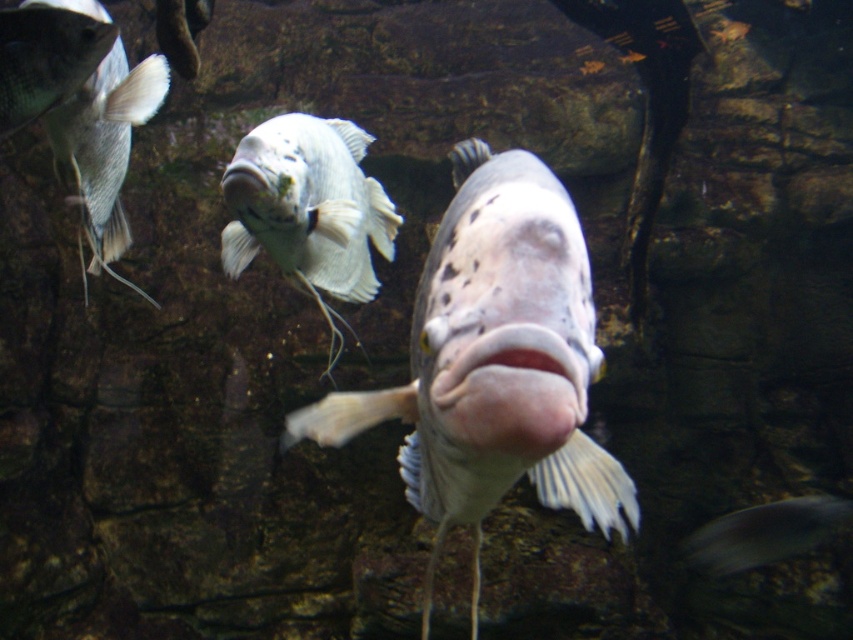
You are a marine biologist observing the underwater scene. You notice two fish, the matte white fish at upper left and the silvery metallic fish at lower right. Which one has a larger size?

The matte white fish at upper left is bigger than the silvery metallic fish at lower right.

You are a marine biologist observing underwater life. You notice a speckled white fish at center and a matte white fish at upper left. Given that the average distance between two fish of the same species in this environment is 25 inches, do you think these two fish are likely of the same species?

The distance between the speckled white fish at center and the matte white fish at upper left is 32.98 inches, which is greater than the average of 25 inches. This suggests they might not be of the same species, as same species fish typically maintain closer proximity.

You are a marine biologist observing the underwater scene. You notice two fish, the speckled white fish at center and the matte white fish at upper left. Which fish has a greater height?

The speckled white fish at center is taller than the matte white fish at upper left according to the description.